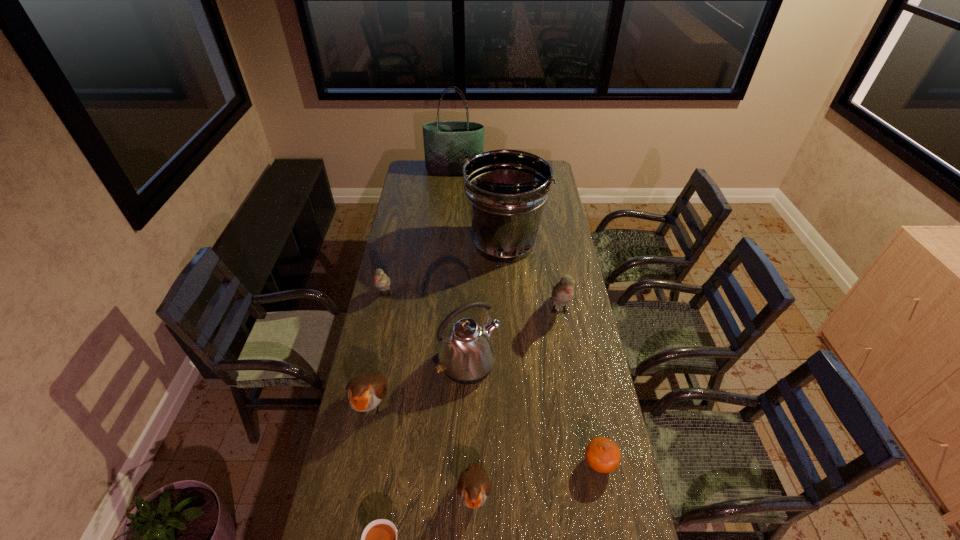
Identify the location of tote bag. (445, 142).

You are a GUI agent. You are given a task and a screenshot of the screen. Output one action in this format:
    pyautogui.click(x=<x>, y=<y>)
    Task: Click on the farthest object
    Image resolution: width=960 pixels, height=540 pixels.
    Given the screenshot: What is the action you would take?
    pyautogui.click(x=445, y=142)

Where is `bucket`? The width and height of the screenshot is (960, 540). bucket is located at coordinates (506, 190).

At what (x,y) coordinates should I click in order to perform the action: click on the seventh shortest object. Please return your answer as a coordinate pair (x, y). This screenshot has height=540, width=960. Looking at the image, I should click on (467, 355).

You are a GUI agent. You are given a task and a screenshot of the screen. Output one action in this format:
    pyautogui.click(x=<x>, y=<y>)
    Task: Click on the right white bird
    This screenshot has width=960, height=540.
    Given the screenshot: What is the action you would take?
    pyautogui.click(x=563, y=292)

Locate an element on the screen. The height and width of the screenshot is (540, 960). the tallest bird is located at coordinates (563, 292).

You are a GUI agent. You are given a task and a screenshot of the screen. Output one action in this format:
    pyautogui.click(x=<x>, y=<y>)
    Task: Click on the third farthest bird
    The height and width of the screenshot is (540, 960).
    Given the screenshot: What is the action you would take?
    pyautogui.click(x=364, y=393)

This screenshot has height=540, width=960. What are the coordinates of `the bigger brown bird` in the screenshot? It's located at (364, 393).

Image resolution: width=960 pixels, height=540 pixels. I want to click on the smaller white bird, so click(x=382, y=281).

This screenshot has height=540, width=960. Find the location of `the shortest bird`. the shortest bird is located at coordinates (473, 486).